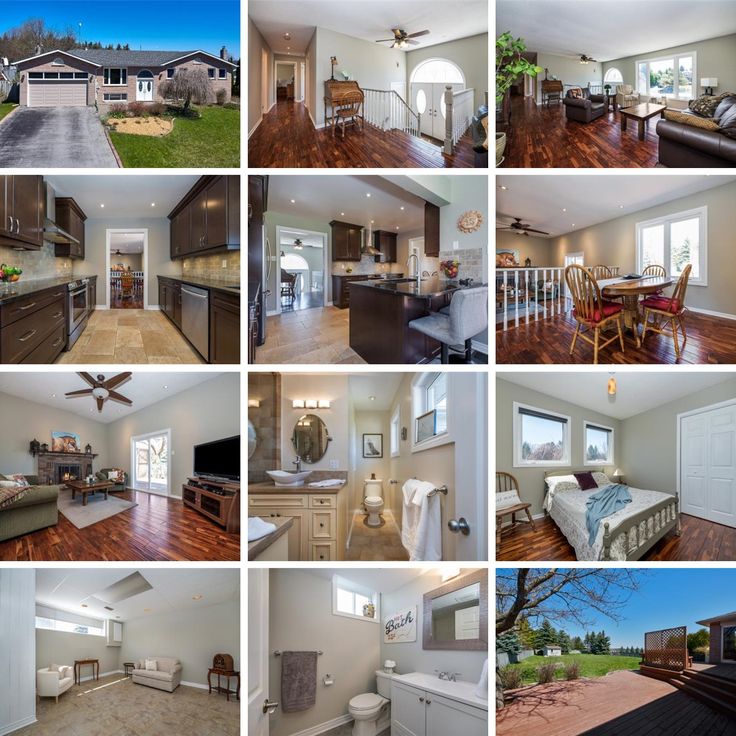
The image size is (736, 736). I want to click on seating, so click(160, 673), click(57, 676), click(21, 497), click(672, 299), click(648, 271), click(597, 269), click(592, 316), click(704, 105), click(598, 101), click(439, 316).